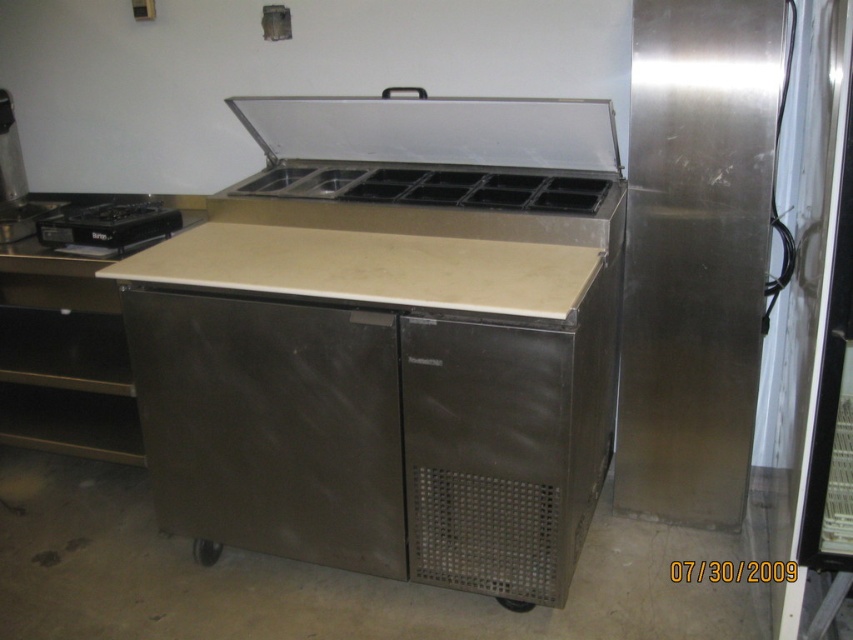
Question: Is the position of stainless steel ice cream freezer at center more distant than that of black matte gas stove at left?

Choices:
 (A) yes
 (B) no

Answer: (B)

Question: Which of the following is the farthest from the observer?

Choices:
 (A) stainless steel ice cream freezer at center
 (B) black matte gas stove at left
 (C) stainless steel/reflective exhaust hood at center
 (D) brushed metal drawer at lower left

Answer: (D)

Question: Can you confirm if stainless steel ice cream freezer at center is bigger than stainless steel/reflective exhaust hood at center?

Choices:
 (A) yes
 (B) no

Answer: (A)

Question: Does stainless steel ice cream freezer at center have a greater width compared to black matte gas stove at left?

Choices:
 (A) yes
 (B) no

Answer: (A)

Question: Which object appears farthest from the camera in this image?

Choices:
 (A) brushed metal drawer at lower left
 (B) stainless steel/reflective exhaust hood at center
 (C) black matte gas stove at left

Answer: (A)

Question: Among these objects, which one is nearest to the camera?

Choices:
 (A) stainless steel/reflective exhaust hood at center
 (B) black matte gas stove at left
 (C) stainless steel ice cream freezer at center
 (D) brushed metal drawer at lower left

Answer: (C)